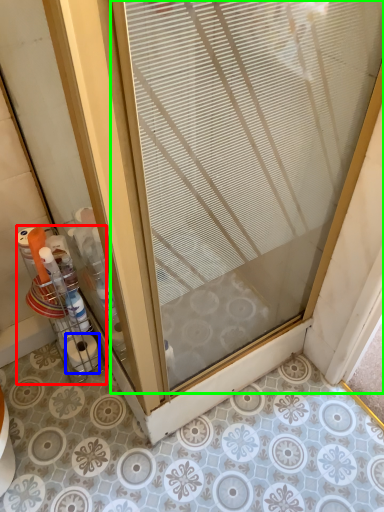
Question: Based on their relative distances, which object is nearer to glass box (highlighted by a red box)? Choose from toilet paper (highlighted by a blue box) and door (highlighted by a green box).

Choices:
 (A) toilet paper
 (B) door

Answer: (A)